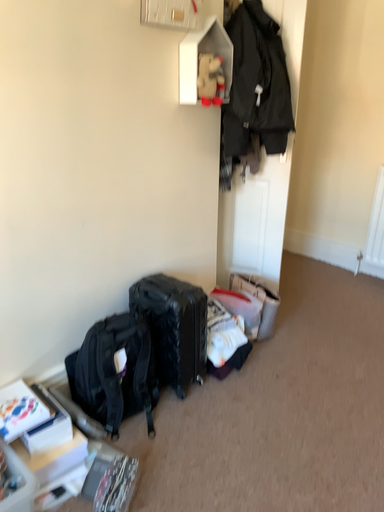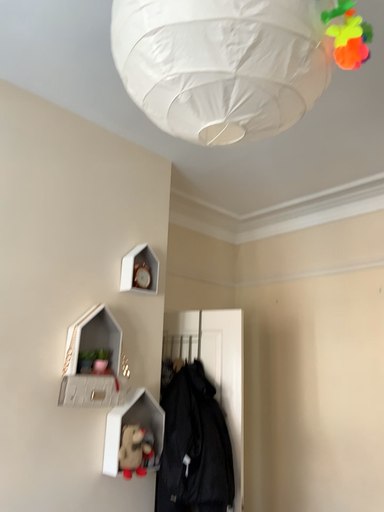
Question: How did the camera likely rotate when shooting the video?

Choices:
 (A) rotated downward
 (B) rotated upward

Answer: (B)